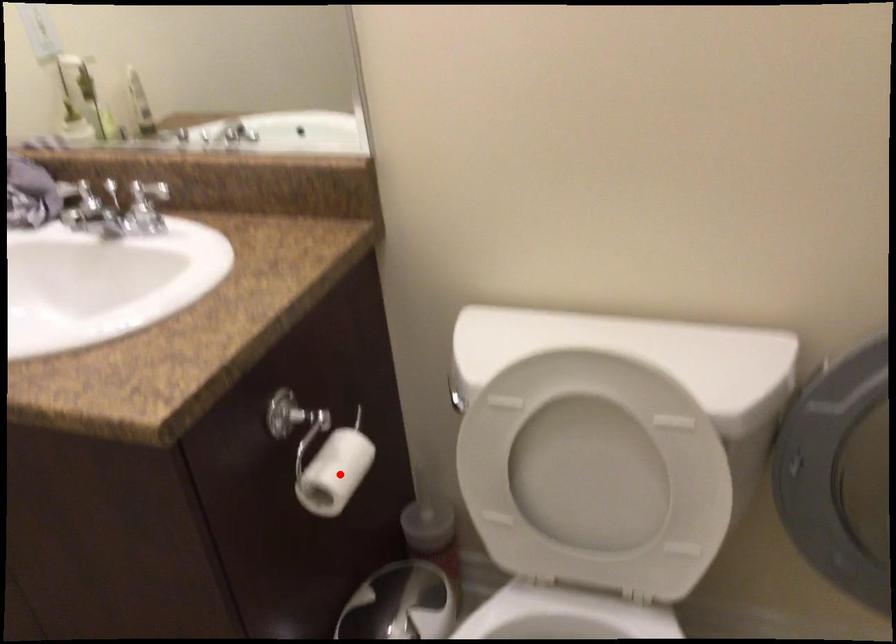
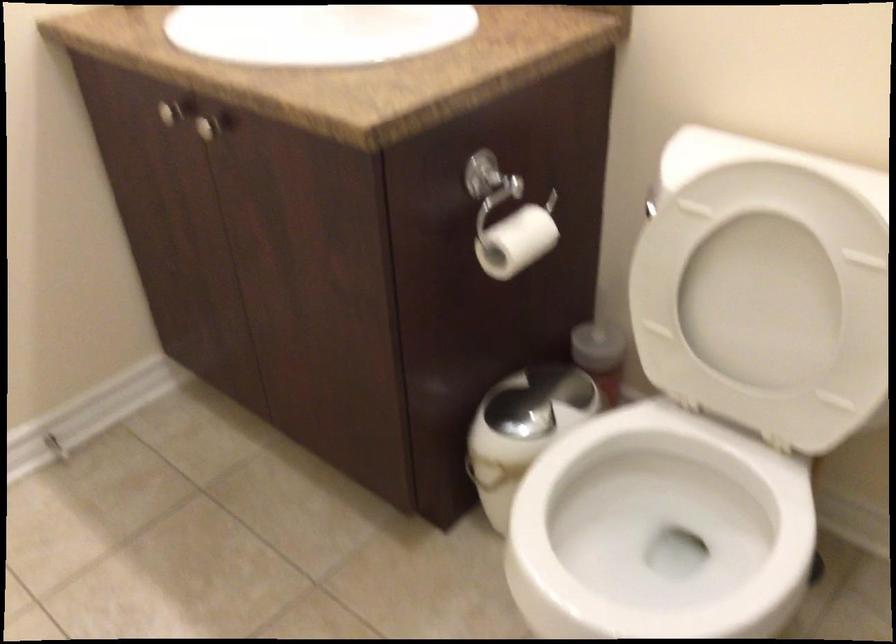
Find the pixel in the second image that matches the highlighted location in the first image.

(515, 242)